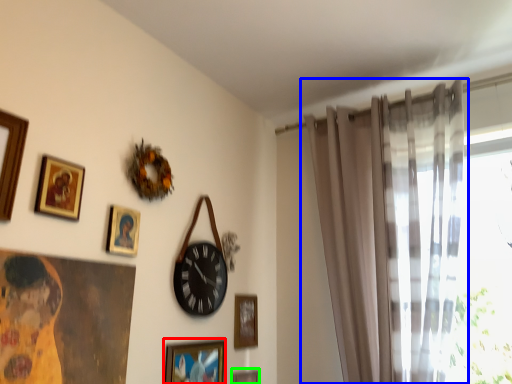
Question: Which object is positioned closest to picture frame (highlighted by a red box)? Select from curtain (highlighted by a blue box) and picture frame (highlighted by a green box).

Choices:
 (A) curtain
 (B) picture frame

Answer: (B)